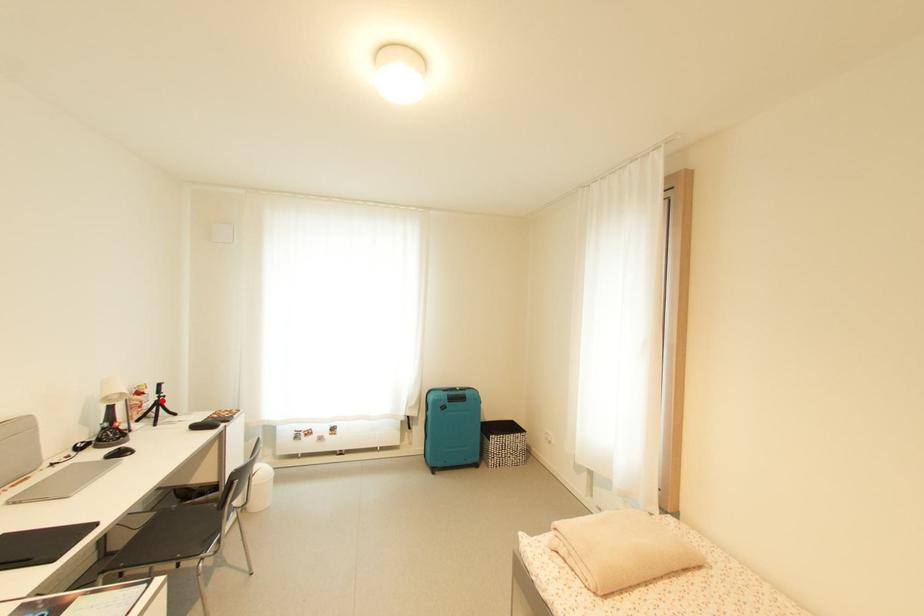
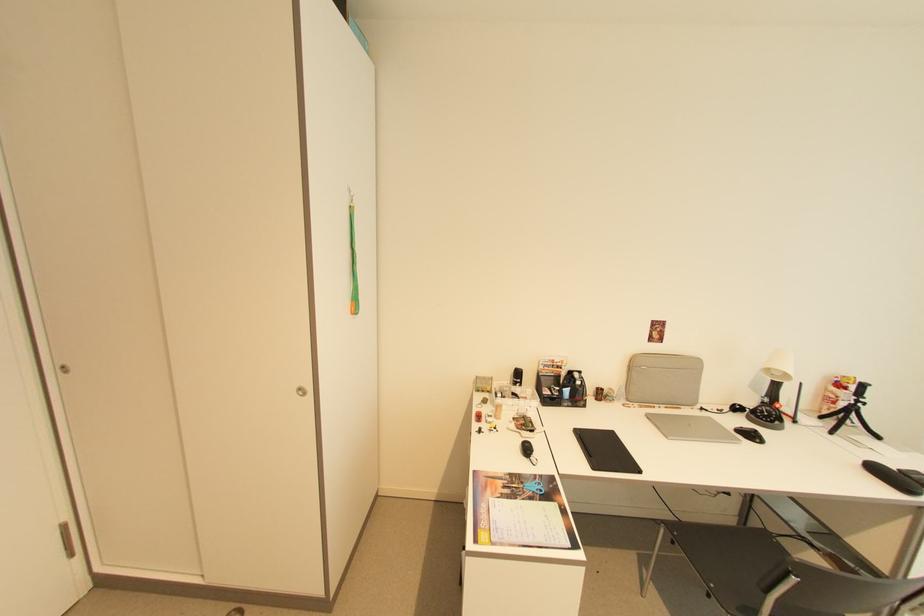
Where in the second image is the point corresponding to the highlighted location from the first image?

(857, 405)